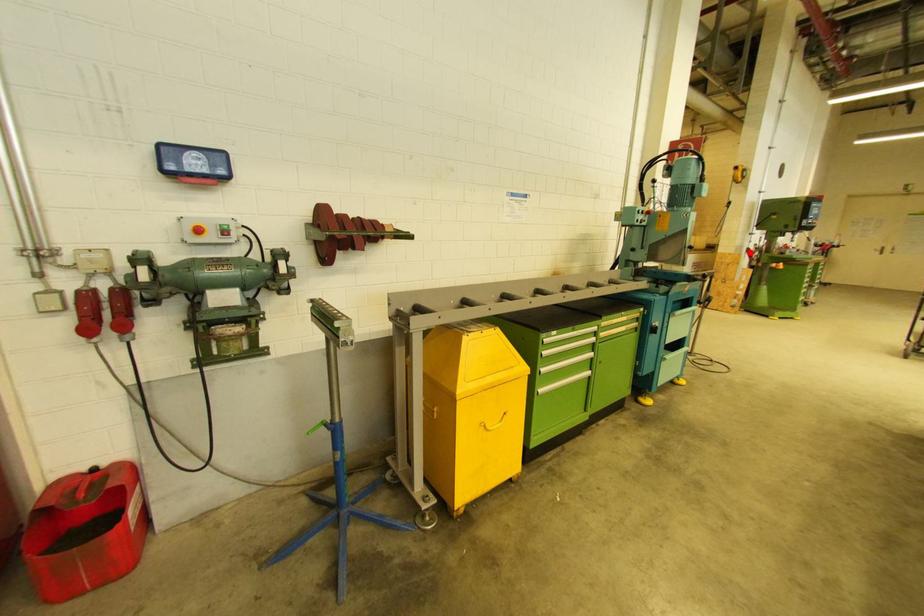
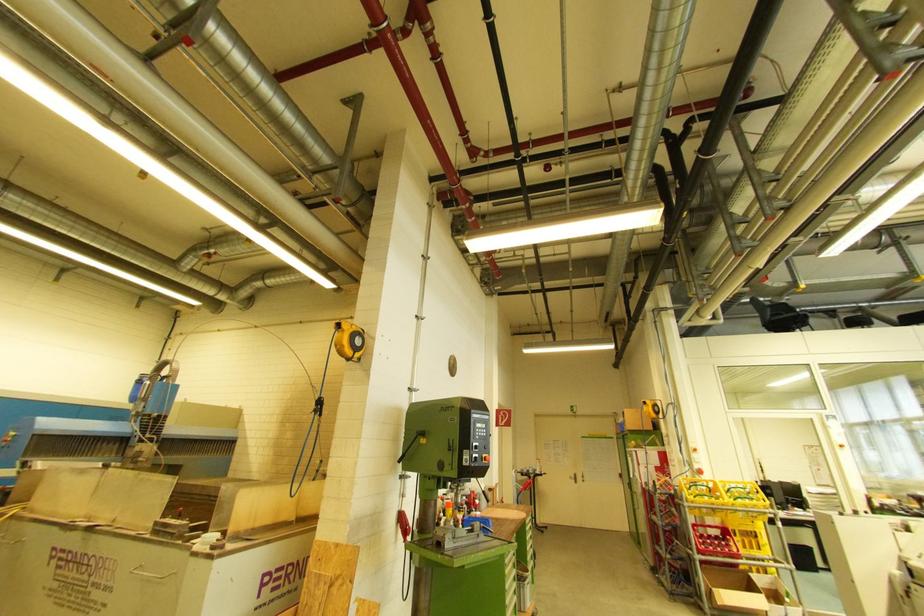
Question: I am providing you with two images of the same scene from different viewpoints. A red point is marked on the first image. At the location where the point appears in image 1, is it still visible in image 2?

Choices:
 (A) Yes
 (B) No

Answer: (A)